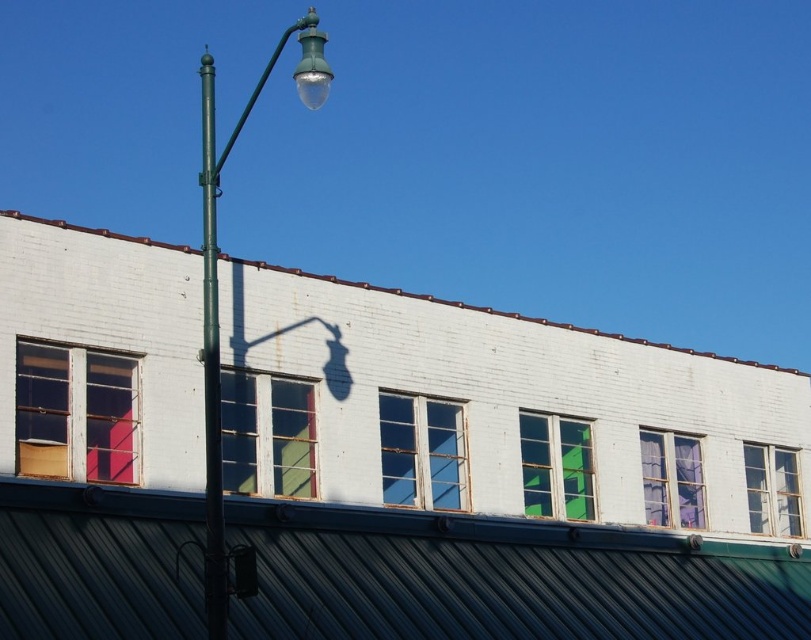
The height and width of the screenshot is (640, 811). What do you see at coordinates (211, 369) in the screenshot? I see `green metallic pole at left` at bounding box center [211, 369].

Find the location of a particular element. The width and height of the screenshot is (811, 640). green metallic pole at left is located at coordinates (211, 369).

Between point (213, 124) and point (753, 500), which one is positioned behind?

The point (213, 124) is behind.

This screenshot has width=811, height=640. Identify the location of green metallic pole at left. (211, 369).

Image resolution: width=811 pixels, height=640 pixels. What do you see at coordinates (423, 451) in the screenshot? I see `clear glass window at center` at bounding box center [423, 451].

Can you confirm if clear glass window at center is bigger than green glass window at upper center?

No, clear glass window at center is not bigger than green glass window at upper center.

Find the location of a particular element. clear glass window at center is located at coordinates (423, 451).

Describe the element at coordinates (217, 310) in the screenshot. I see `green matte street light at upper left` at that location.

Who is more forward, [209,625] or [209,84]?

Point [209,625] is more forward.

Identify the location of green matte street light at upper left. (217, 310).